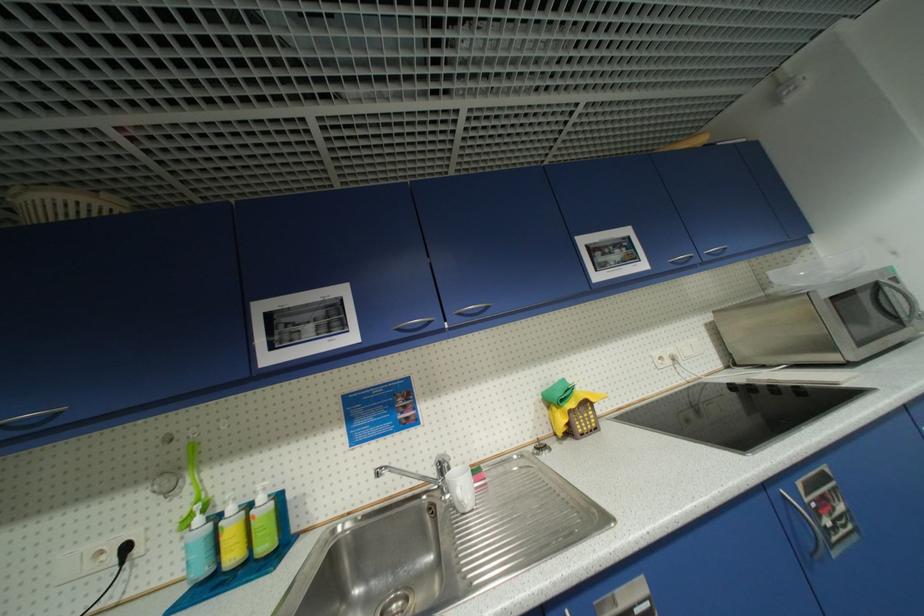
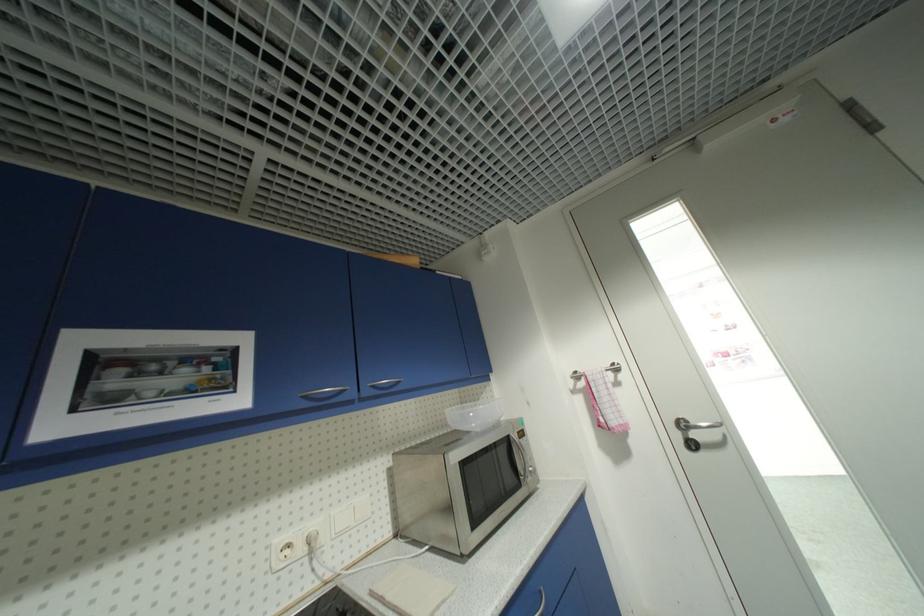
Locate, in the second image, the point that corresponds to point 881,286 in the first image.

(514, 440)